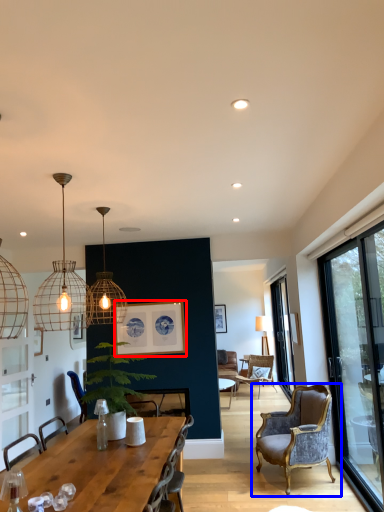
Question: Among these objects, which one is farthest to the camera, picture frame (highlighted by a red box) or chair (highlighted by a blue box)?

Choices:
 (A) picture frame
 (B) chair

Answer: (A)